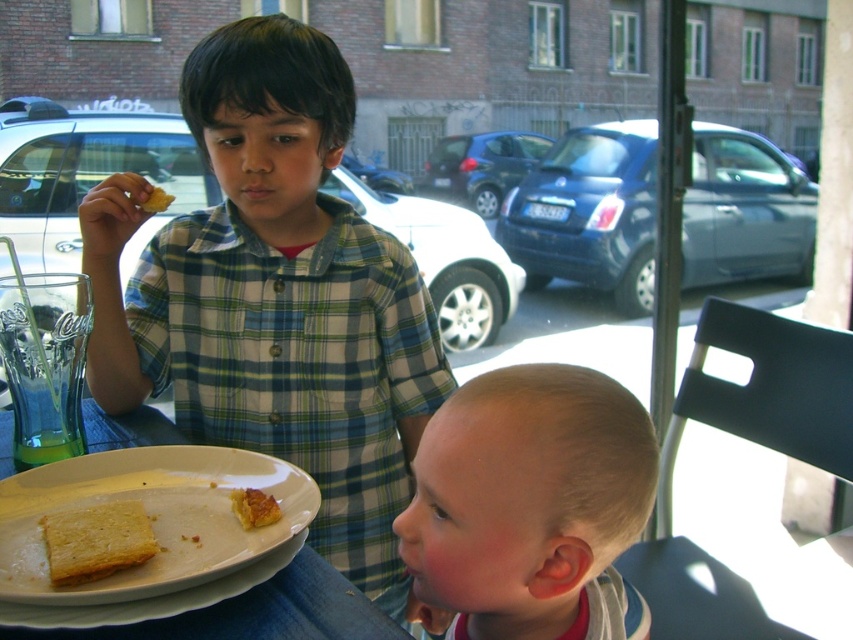
Question: Which point is closer to the camera?

Choices:
 (A) (252, 513)
 (B) (120, 476)
 (C) (218, 424)

Answer: (A)

Question: Which object is farther from the camera taking this photo?

Choices:
 (A) white ceramic plate at lower left
 (B) white toasted bread at lower left
 (C) yellow crumbly bread at upper left

Answer: (C)

Question: Among these points, which one is farthest from the camera?

Choices:
 (A) (653, 442)
 (B) (152, 189)
 (C) (4, 512)
 (D) (236, 509)

Answer: (B)

Question: Is white ceramic plate at lower left above white toasted bread at lower left?

Choices:
 (A) no
 (B) yes

Answer: (B)

Question: Does plaid shirt at center appear over white toasted bread at lower left?

Choices:
 (A) no
 (B) yes

Answer: (B)

Question: Does blonde hair at lower right have a greater width compared to white toasted bread at lower left?

Choices:
 (A) no
 (B) yes

Answer: (B)